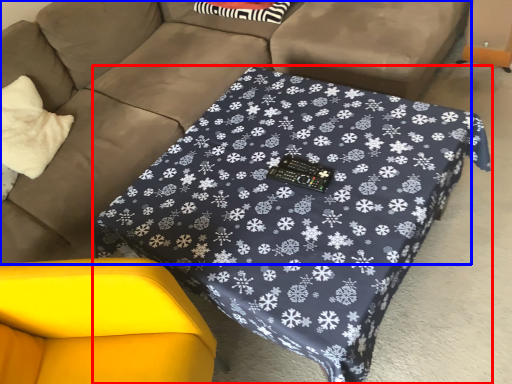
Question: Which object appears closest to the camera in this image, table (highlighted by a red box) or studio couch (highlighted by a blue box)?

Choices:
 (A) table
 (B) studio couch

Answer: (B)